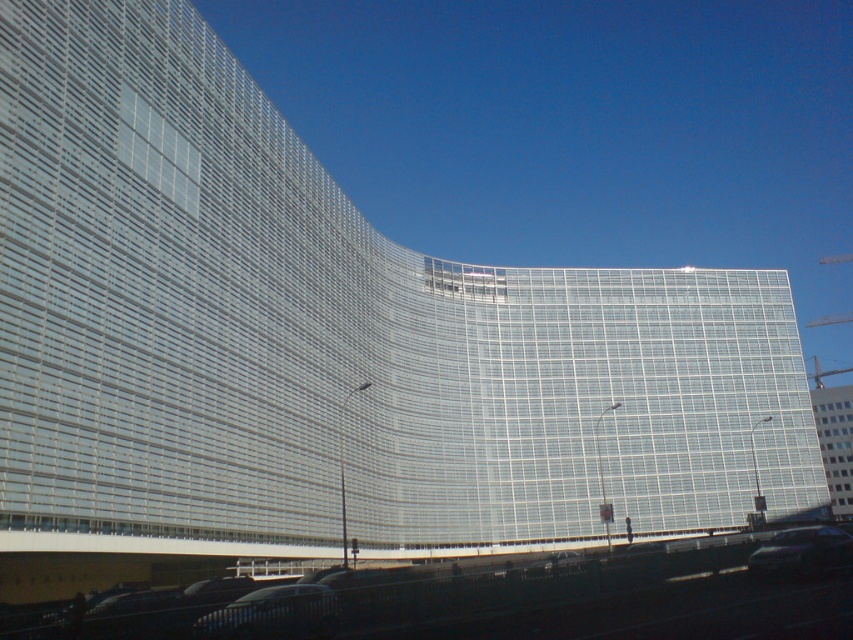
Question: Among these points, which one is farthest from the camera?

Choices:
 (A) click(798, 544)
 (B) click(73, 602)
 (C) click(276, 625)
 (D) click(537, 561)

Answer: (B)

Question: Which point is closer to the camera?

Choices:
 (A) shiny black car at lower center
 (B) black asphalt train track at lower center
 (C) metallic silver car at center

Answer: (B)

Question: Estimate the real-world distances between objects in this image. Which object is closer to the black asphalt train track at lower center?

Choices:
 (A) shiny black car at lower right
 (B) metallic silver car at center
 (C) shiny black car at lower center

Answer: (C)

Question: Is shiny black car at lower center above metallic silver car at center?

Choices:
 (A) no
 (B) yes

Answer: (B)

Question: From the image, what is the correct spatial relationship of shiny black car at lower center in relation to metallic silver car at center?

Choices:
 (A) left
 (B) right

Answer: (A)

Question: In this image, where is black asphalt train track at lower center located relative to shiny black car at lower center?

Choices:
 (A) below
 (B) above

Answer: (A)